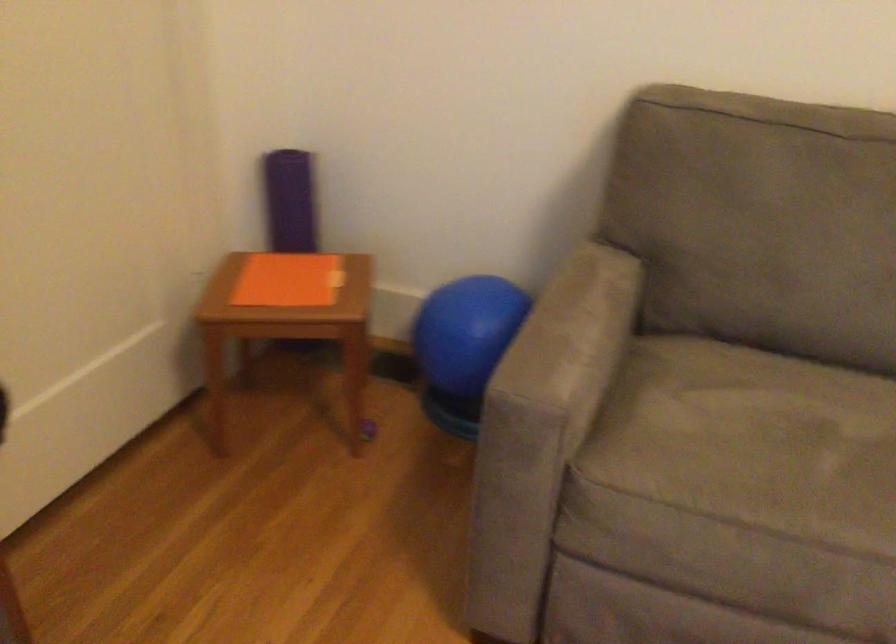
You are a GUI agent. You are given a task and a screenshot of the screen. Output one action in this format:
    pyautogui.click(x=<x>, y=<y>)
    Task: Click on the purple yoga mat
    
    Given the screenshot: What is the action you would take?
    pyautogui.click(x=289, y=201)